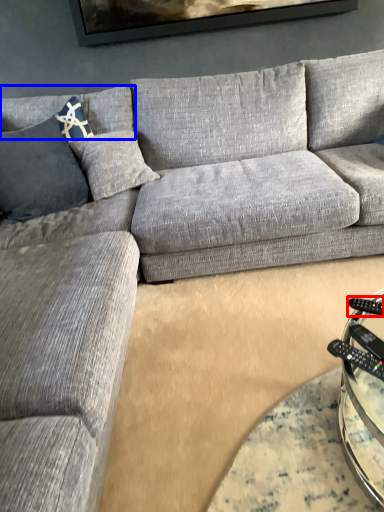
Question: Which of the following is the closest to the observer, remote (highlighted by a red box) or pillow (highlighted by a blue box)?

Choices:
 (A) remote
 (B) pillow

Answer: (A)